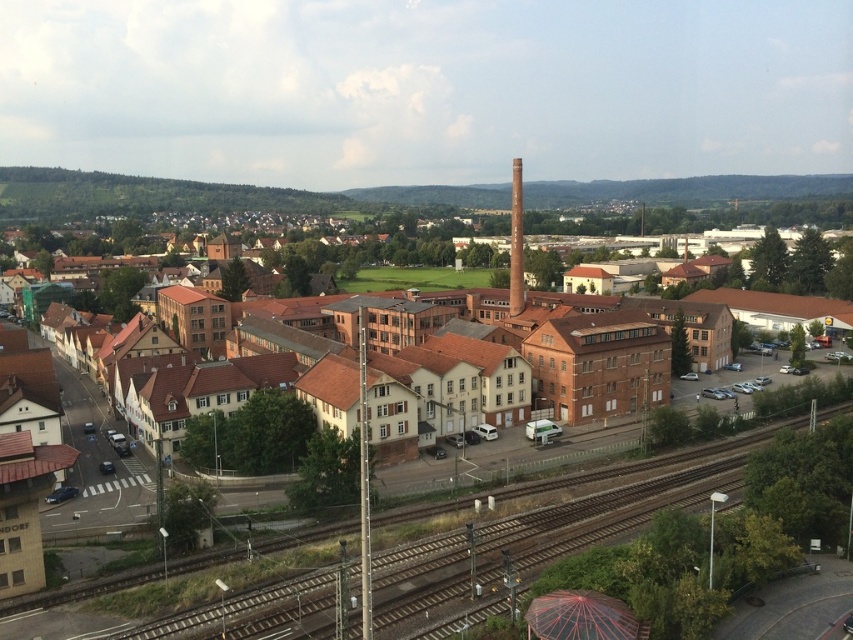
You are standing at the point marked as point (97,294) in the image. What type of building is located at this point?

The point (97,294) is occupied by a brown brick building at center.

You are standing at the point with coordinates point (762, 435) and want to walk towards the point with coordinates point (129, 244). Which direction should you move relative to your current position?

You should move towards the point (129, 244) by going northeast since it is located behind point (762, 435).

You are standing at the edge of the town and see the brown brick building at center and the brown wooden train track at lower center. Which object is located to the left of the other?

The brown brick building at center is positioned on the left side of brown wooden train track at lower center.